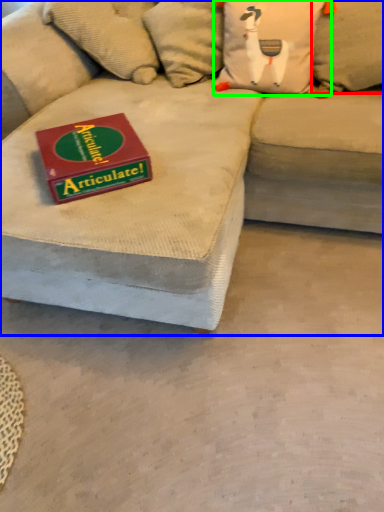
Question: Estimate the real-world distances between objects in this image. Which object is closer to pillow (highlighted by a red box), studio couch (highlighted by a blue box) or pillow (highlighted by a green box)?

Choices:
 (A) studio couch
 (B) pillow

Answer: (B)